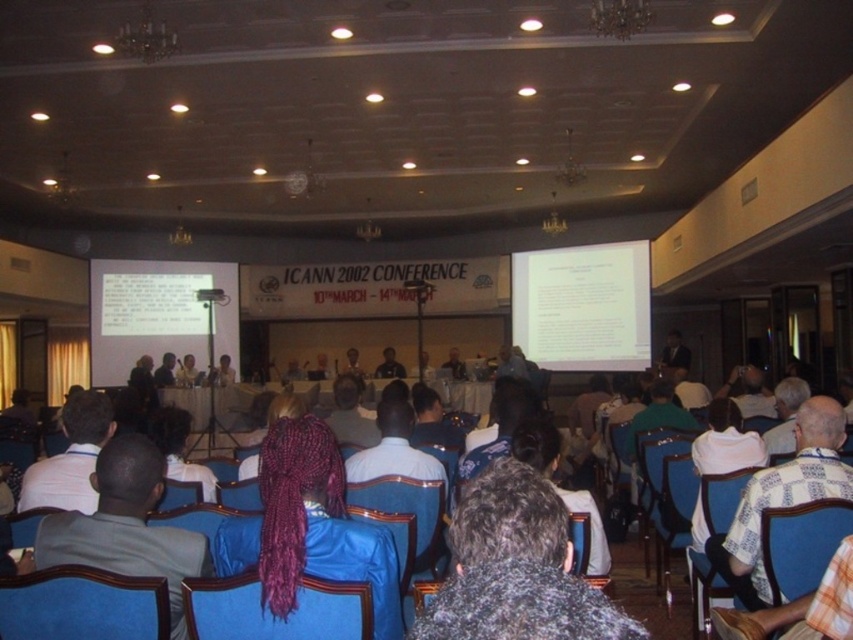
You are a photographer at the ICANN 2002 Conference. You need to capture a closeup shot of the dark purple braided hair at center without the dark gray sweater at center blocking it. Is this possible?

The dark gray sweater at center is positioned over dark purple braided hair at center, so it is blocking the view. Therefore, it is not possible to capture the dark purple braided hair at center without the sweater blocking it.

Looking at this image, you are an attendee at the ICANN 2002 Conference. You are standing at the point with coordinates point (601, 596) and want to move to the exit located at point (142, 611). Will you need to walk behind the audience seated in blue chairs with wooden frames to reach the exit?

Point (601, 596) is in front of point (142, 611), so you will not need to walk behind the audience seated in blue chairs with wooden frames to reach the exit.